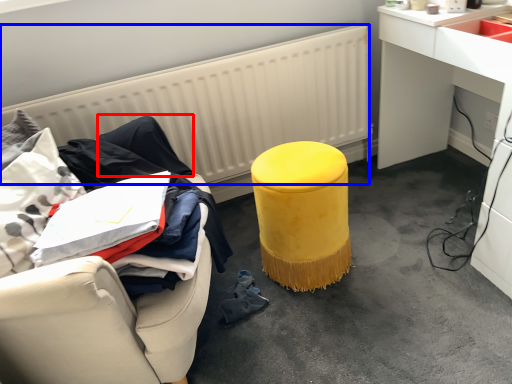
Question: Which object is further to the camera taking this photo, clothing (highlighted by a red box) or radiator (highlighted by a blue box)?

Choices:
 (A) clothing
 (B) radiator

Answer: (B)